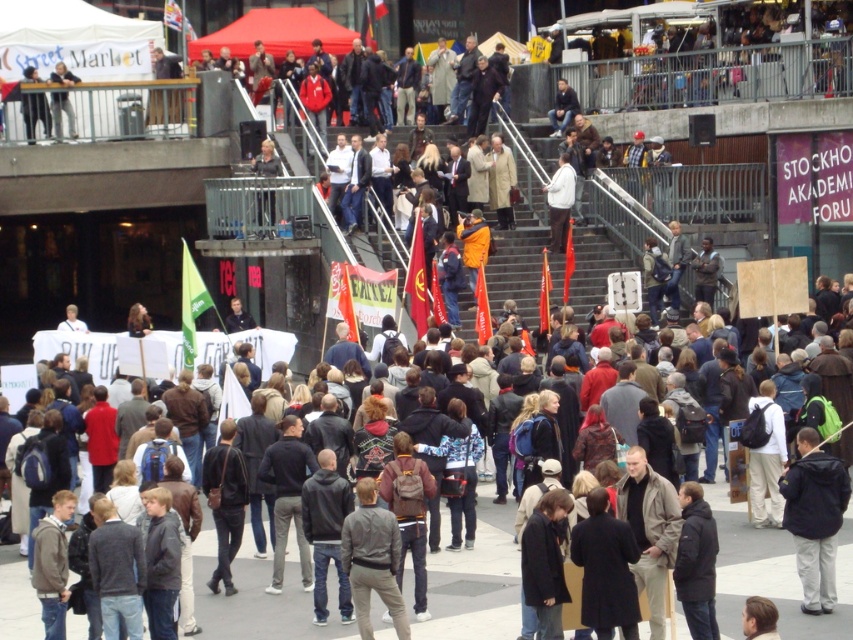
You are a photographer standing at the edge of the crowd in the city square. You see the black leather jacket at center and a camera. How far apart are these two items?

The black leather jacket at center and the camera are 137.62 feet apart from each other.

You are a photographer trying to capture a photo of the dark gray sweater at center and the dark gray jacket at upper left. Which one appears bigger in the photo?

The dark gray sweater at center appears bigger in the photo because it has a larger size compared to the dark gray jacket at upper left.

You are a photographer standing near the camera in the scene. You want to capture a closeup of the dark gray sweater at center. Can you do this without moving the camera? Explain why or why not.

The dark gray sweater at center and the camera are 36.39 meters apart. Since this distance is quite large, capturing a closeup without moving the camera would be challenging unless using a telephoto lens capable of zooming in from that distance. However, standard camera lenses might not provide sufficient zoom to achieve a clear closeup at 36.39 meters.